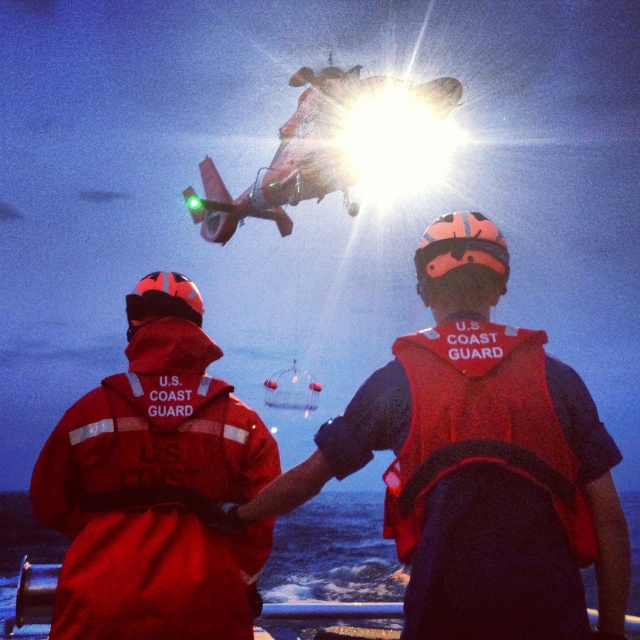
You are a rescue swimmer on a boat during a nighttime operation. You need to quickly grab either the orange life vest at center or the red fabric life jacket at center. Which one is positioned to your left?

The orange life vest at center is positioned to the left of the red fabric life jacket at center, so the orange life vest at center is on your left.

You are standing on the deck of the boat and want to know how far you are from the point marked at coordinates (595,477). Can you determine the distance?

The point marked at coordinates (595,477) is 8.63 meters away from you.